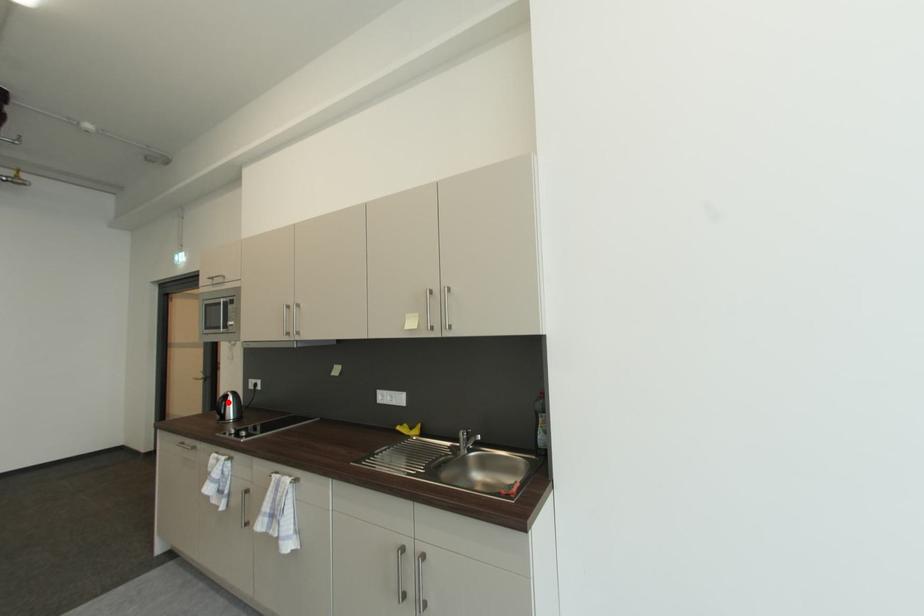
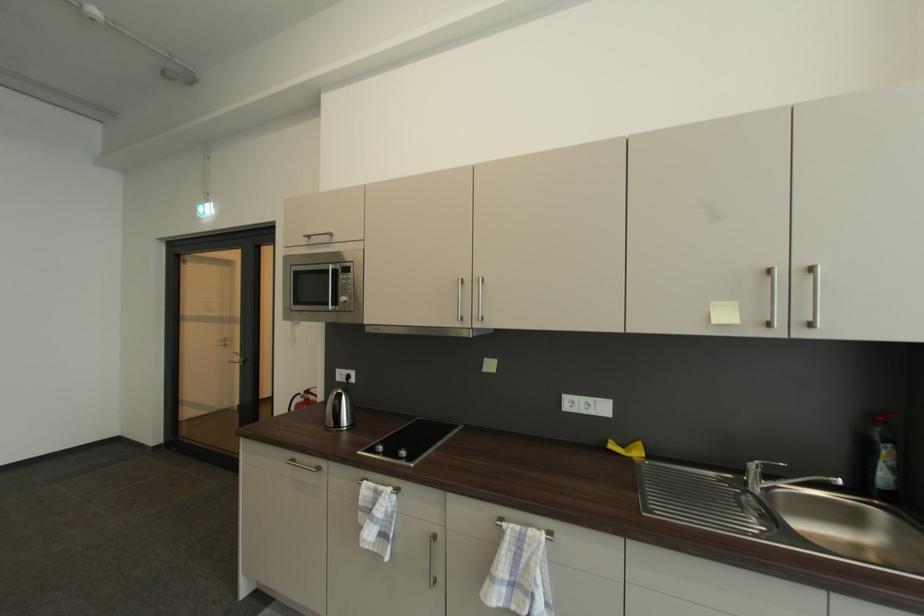
Locate, in the second image, the point that corresponds to the highlighted location in the first image.

(344, 403)